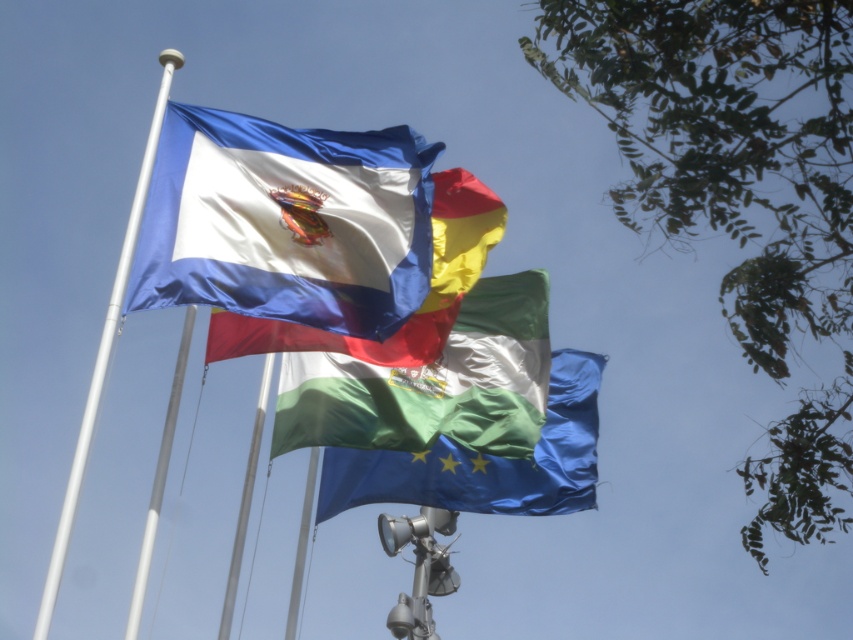
Question: Can you confirm if silky white flag at center is positioned to the left of white glossy flag pole at left?

Choices:
 (A) yes
 (B) no

Answer: (B)

Question: Which point is closer to the camera taking this photo?

Choices:
 (A) (225, 582)
 (B) (538, 468)
 (C) (108, 352)

Answer: (C)

Question: Which point is closer to the camera?

Choices:
 (A) blue glossy flag at center
 (B) satin blue flag at upper center

Answer: (B)

Question: Which object is positioned farthest from the satin blue flag at upper center?

Choices:
 (A) white metallic flag pole at left
 (B) silky white flag at center
 (C) blue glossy flag at center
 (D) metallic silver flag pole at center

Answer: (C)

Question: Is blue glossy flag at center below white glossy flag pole at left?

Choices:
 (A) yes
 (B) no

Answer: (A)

Question: Does satin blue flag at upper center have a larger size compared to white metallic flag pole at left?

Choices:
 (A) no
 (B) yes

Answer: (A)